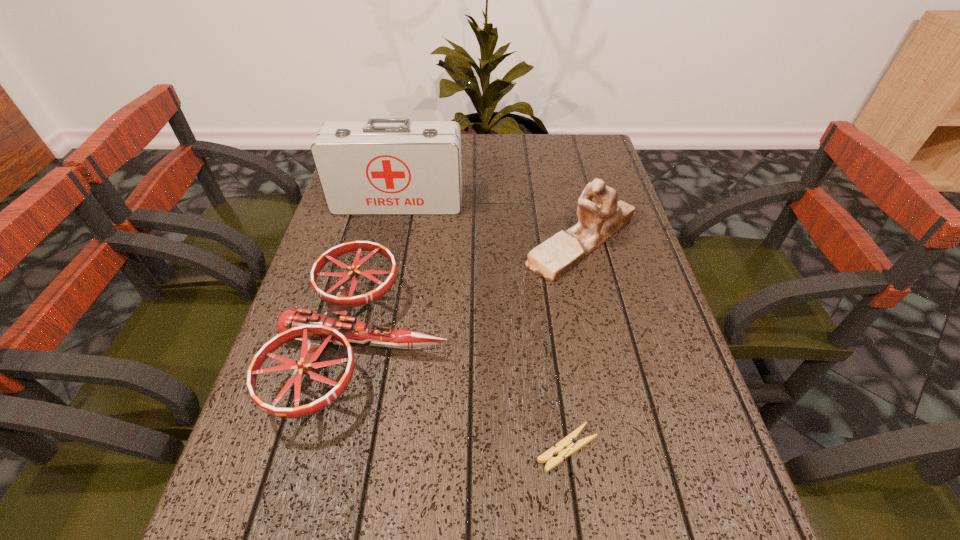
The image size is (960, 540). What are the coordinates of `the first-aid kit at the left edge` in the screenshot? It's located at (381, 166).

You are a GUI agent. You are given a task and a screenshot of the screen. Output one action in this format:
    pyautogui.click(x=<x>, y=<y>)
    Task: Click on the drone present at the left edge
    
    Given the screenshot: What is the action you would take?
    pyautogui.click(x=315, y=330)

This screenshot has width=960, height=540. I want to click on object located in the right edge section of the desktop, so click(x=600, y=216).

Find the location of `free region at the far edge of the desktop`. free region at the far edge of the desktop is located at coordinates (466, 141).

Image resolution: width=960 pixels, height=540 pixels. In the image, there is a desktop. What are the coordinates of `vacant space at the left edge` in the screenshot? It's located at (355, 369).

You are a GUI agent. You are given a task and a screenshot of the screen. Output one action in this format:
    pyautogui.click(x=<x>, y=<y>)
    Task: Click on the vacant space at the right edge of the desktop
    The image size is (960, 540).
    Given the screenshot: What is the action you would take?
    pyautogui.click(x=655, y=424)

In the image, there is a desktop. What are the coordinates of `vacant area at the far right corner` in the screenshot? It's located at (568, 144).

The height and width of the screenshot is (540, 960). I want to click on free space between the first-aid kit and the third shortest object, so click(x=490, y=222).

Where is `free point between the first-aid kit and the figurine`? Image resolution: width=960 pixels, height=540 pixels. free point between the first-aid kit and the figurine is located at coordinates (490, 222).

This screenshot has height=540, width=960. Identify the location of unoccupied position between the shortest object and the drone. (467, 395).